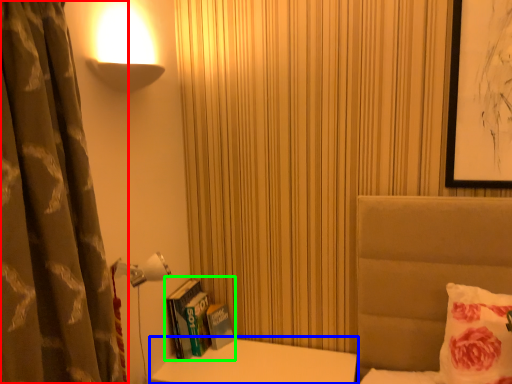
Question: Which object is the farthest from curtain (highlighted by a red box)? Choose among these: table (highlighted by a blue box) or book (highlighted by a green box).

Choices:
 (A) table
 (B) book

Answer: (A)